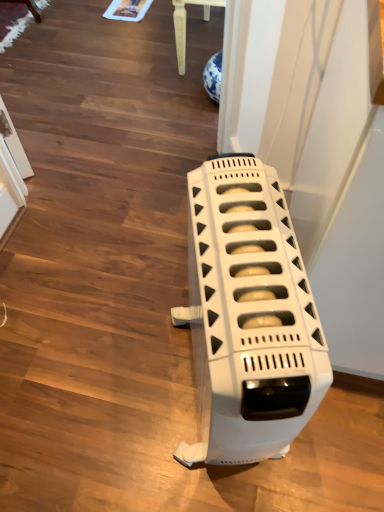
What is the approximate width of white glossy radiator at center?

white glossy radiator at center is 17.08 inches wide.

Describe the element at coordinates (248, 316) in the screenshot. Image resolution: width=384 pixels, height=512 pixels. I see `white glossy radiator at center` at that location.

I want to click on white glossy radiator at center, so click(x=248, y=316).

At what (x,y) coordinates should I click in order to perform the action: click on white glossy radiator at center. Please return your answer as a coordinate pair (x, y). Looking at the image, I should click on (248, 316).